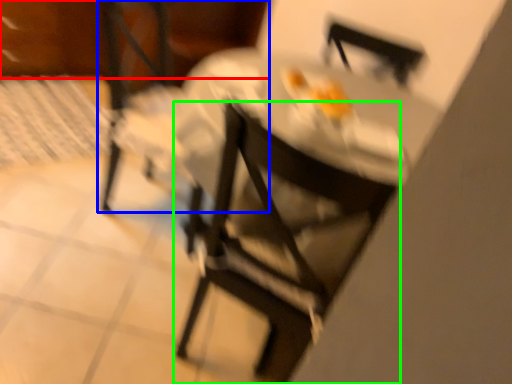
Question: Which object is positioned closest to leftover (highlighted by a red box)? Select from chair (highlighted by a blue box) and chair (highlighted by a green box).

Choices:
 (A) chair
 (B) chair

Answer: (A)